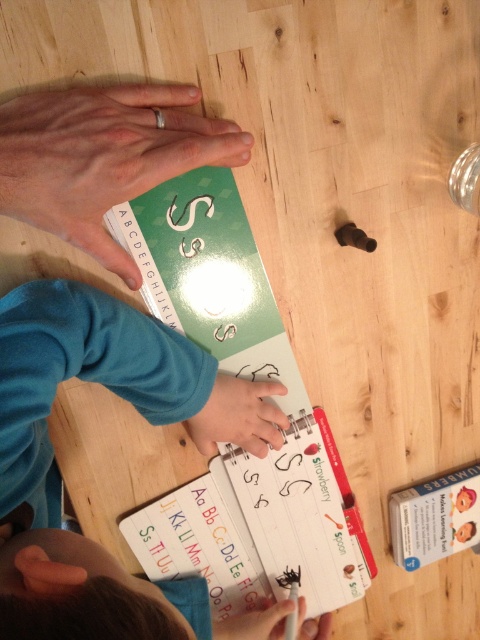
You are a teacher observing a child learning to write letters. You see a blue fleece sweater at center and a white paper at center. Which object is positioned to the right of the other?

The blue fleece sweater at center is to the left of white paper at center, so the white paper at center is positioned to the right of the blue fleece sweater at center.

You are a teacher observing a classroom scene. You see a blue fleece sweater at center and a green paper book at center. Which object is positioned to the left?

The blue fleece sweater at center is to the left of the green paper book at center.

From the picture: You are a photographer who wants to take a closeup of the green paper book at center. The camera you are using has a minimum focusing distance of 24 inches. Can you take the photo without moving the book?

The green paper book at center and camera are 23.03 inches apart, which is less than the camera minimum focusing distance of 24 inches. Therefore, you cannot take the photo without moving the book closer.